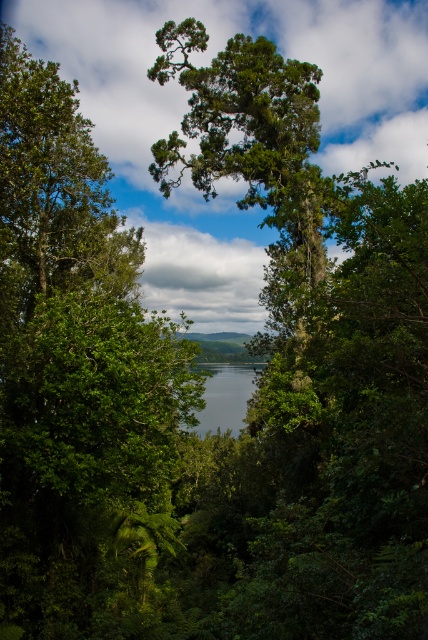
You are a hiker who wants to cross the clear water at center using the green matte tree at center as a bridge. Is the tree positioned in a way that allows you to step from one end of the tree to the water?

The green matte tree at center is located above clear water at center, so yes, the tree is positioned above the water, making it possible to step from the tree to the water if it is sturdy enough.

From the picture: You are a hiker who wants to take a photo of the clear water at center without the green matte tree at center blocking the view. Can you do that by moving forward?

The green matte tree at center is much taller than clear water at center, so moving forward might not help because the tree is taller and could still block the view. You might need to move sideways or backward instead.

In the scene shown: You are standing in the forest and see two points marked in the image. Which point is nearer to you, point (234,45) or point (252,380)?

Point (234,45) is closer to the viewer than point (252,380).